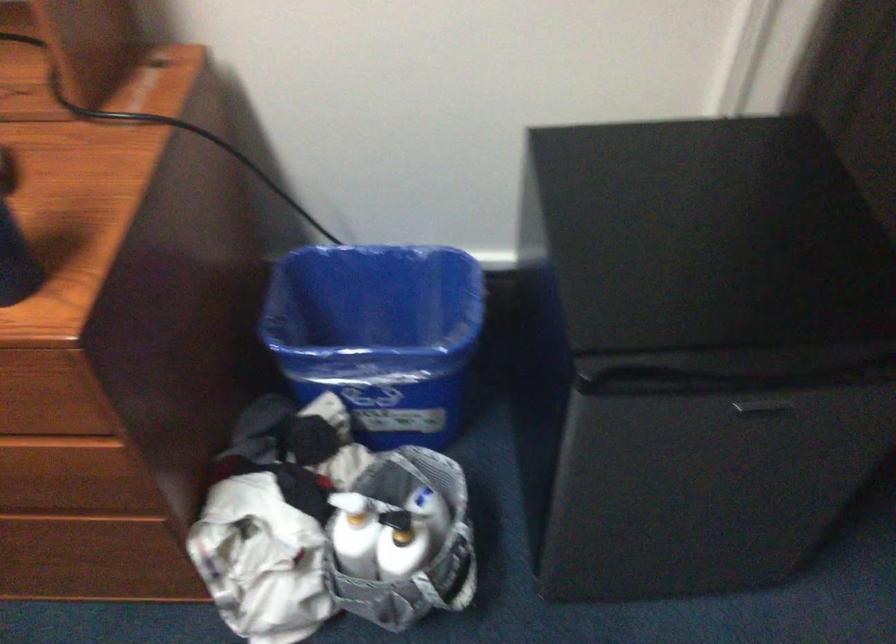
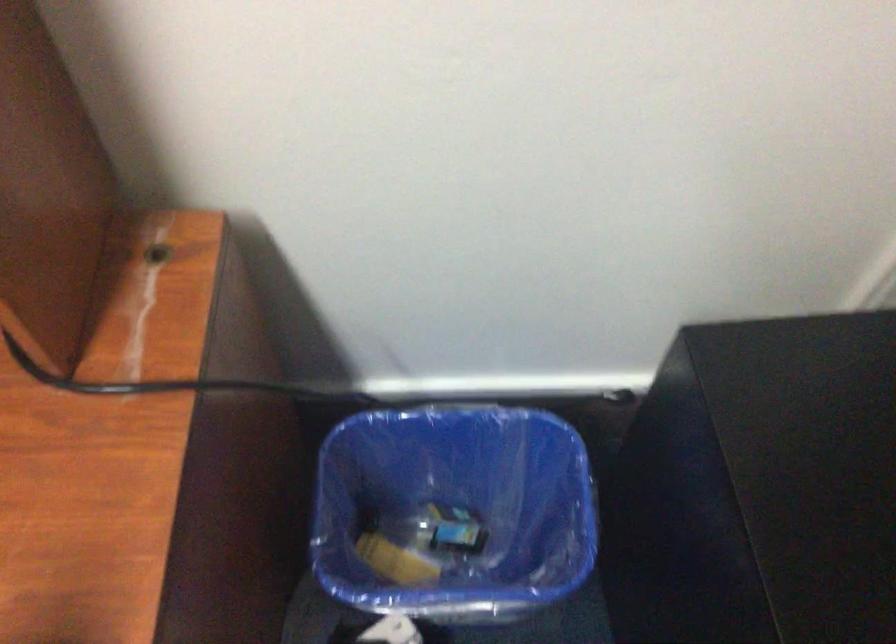
The images are taken continuously from a first-person perspective. In which direction are you moving?

The movement direction of the cameraman is left, forward.